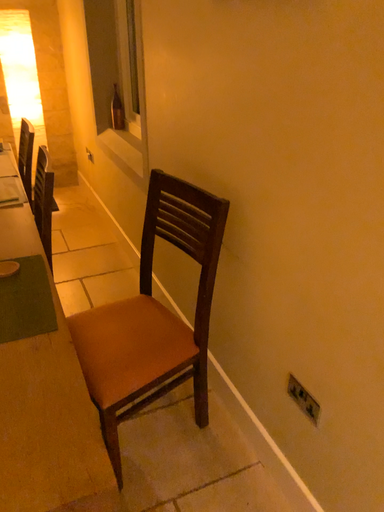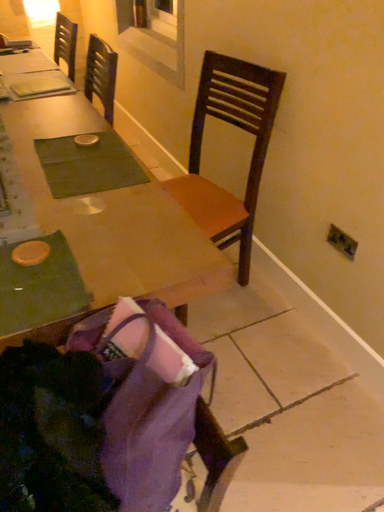
Question: Which way did the camera rotate in the video?

Choices:
 (A) rotated downward
 (B) rotated upward

Answer: (A)